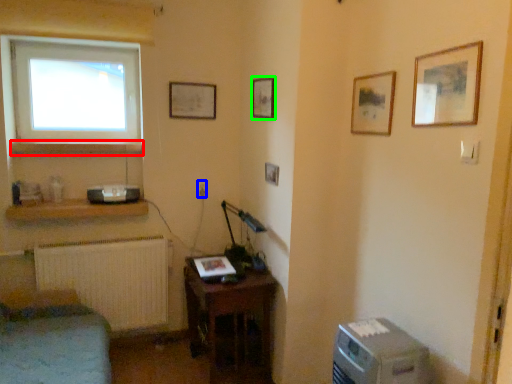
Question: Which object is the farthest from shelf (highlighted by a red box)? Choose among these: electric outlet (highlighted by a blue box) or picture frame (highlighted by a green box).

Choices:
 (A) electric outlet
 (B) picture frame

Answer: (B)